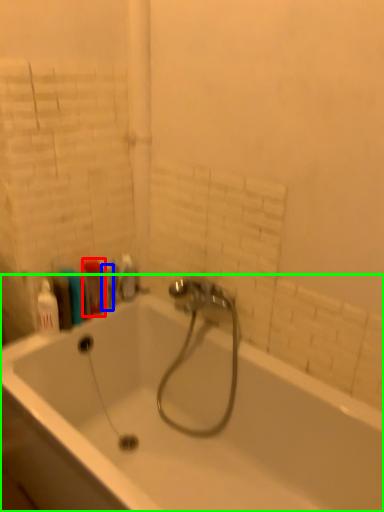
Question: Based on their relative distances, which object is farther from cleaning product (highlighted by a red box)? Choose from toiletry (highlighted by a blue box) and bathtub (highlighted by a green box).

Choices:
 (A) toiletry
 (B) bathtub

Answer: (B)